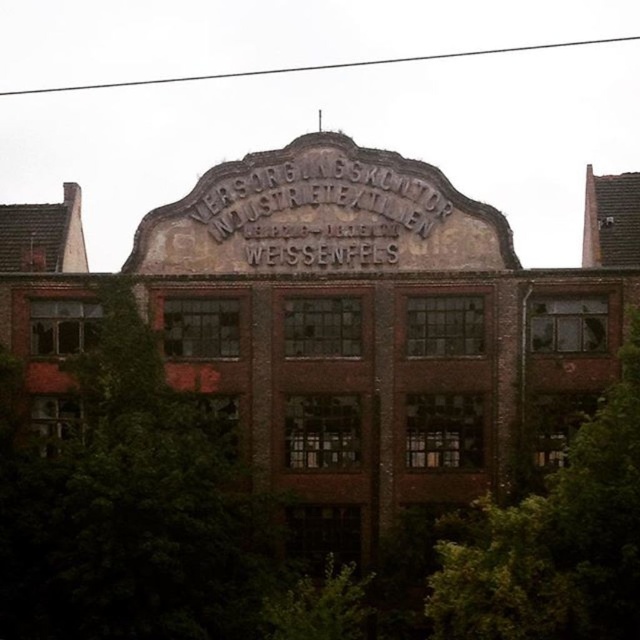
Can you confirm if green leafy tree at left is bigger than green leafy tree at center?

Correct, green leafy tree at left is larger in size than green leafy tree at center.

Is point (173, 404) positioned after point (620, 456)?

Yes, point (173, 404) is farther from viewer.

Where is `green leafy tree at left`? The height and width of the screenshot is (640, 640). green leafy tree at left is located at coordinates (125, 502).

Does green leafy tree at left appear on the left side of black metal sign at center?

Yes, green leafy tree at left is to the left of black metal sign at center.

Is green leafy tree at left below black metal sign at center?

Correct, green leafy tree at left is located below black metal sign at center.

This screenshot has height=640, width=640. Describe the element at coordinates (125, 502) in the screenshot. I see `green leafy tree at left` at that location.

Find the location of a particular element. This screenshot has height=640, width=640. green leafy tree at left is located at coordinates (125, 502).

Is point (596, 624) in front of point (349, 173)?

Yes, it is.

Looking at this image, is green leafy tree at center positioned at the back of black metal sign at center?

No, green leafy tree at center is closer to the viewer.

Which is behind, point (588, 436) or point (256, 209)?

The point (256, 209) is more distant.

This screenshot has height=640, width=640. I want to click on green leafy tree at center, so click(556, 538).